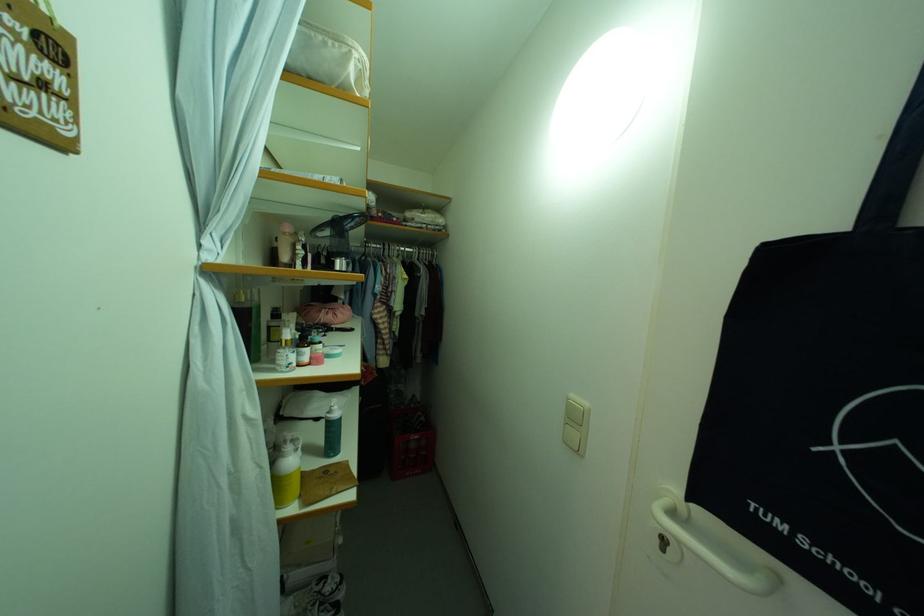
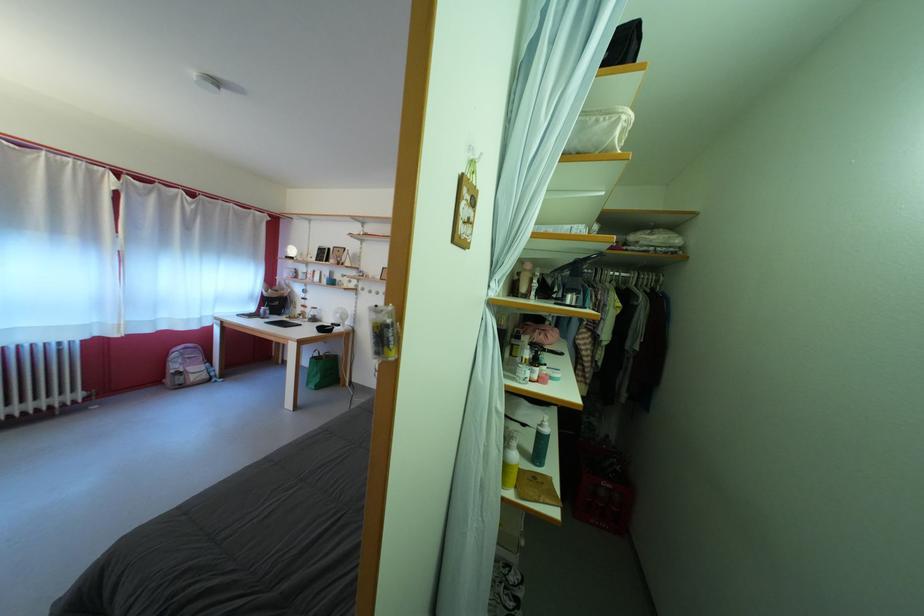
In the second image, find the point that corresponds to (334,51) in the first image.

(605, 128)